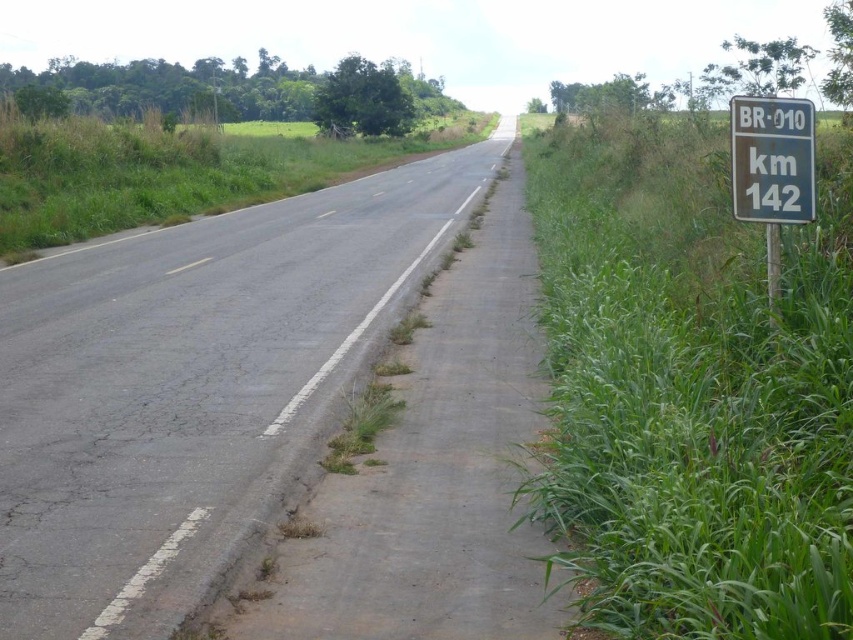
Question: Which object is closer to the camera taking this photo?

Choices:
 (A) green grass at center
 (B) green grass at right
 (C) asphalt road at center

Answer: (B)

Question: Can you confirm if green grass at right is positioned below asphalt road at center?

Choices:
 (A) yes
 (B) no

Answer: (B)

Question: Does green grass at right lie behind asphalt road at center?

Choices:
 (A) yes
 (B) no

Answer: (B)

Question: Which point appears closest to the camera in this image?

Choices:
 (A) (315, 177)
 (B) (112, 273)
 (C) (753, 262)

Answer: (C)

Question: Where is green grass at right located in relation to green grass at center in the image?

Choices:
 (A) left
 (B) right

Answer: (B)

Question: Based on their relative distances, which object is nearer to the asphalt road at center?

Choices:
 (A) green grass at right
 (B) green grass at center

Answer: (A)